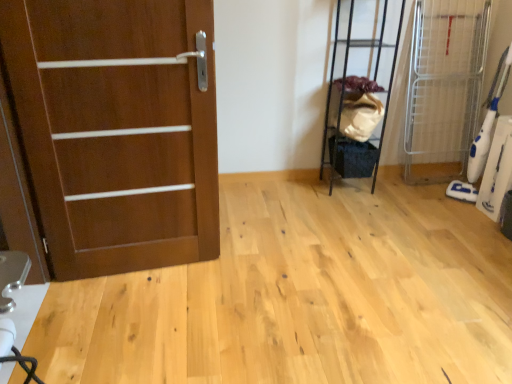
Where is `free space between white plastic vacuum cleaner at right, which is counted as the first elevator, starting from the right, and black metal shelf at upper right, which ranks as the second elevator in right-to-left order`? This screenshot has height=384, width=512. free space between white plastic vacuum cleaner at right, which is counted as the first elevator, starting from the right, and black metal shelf at upper right, which ranks as the second elevator in right-to-left order is located at coordinates (409, 189).